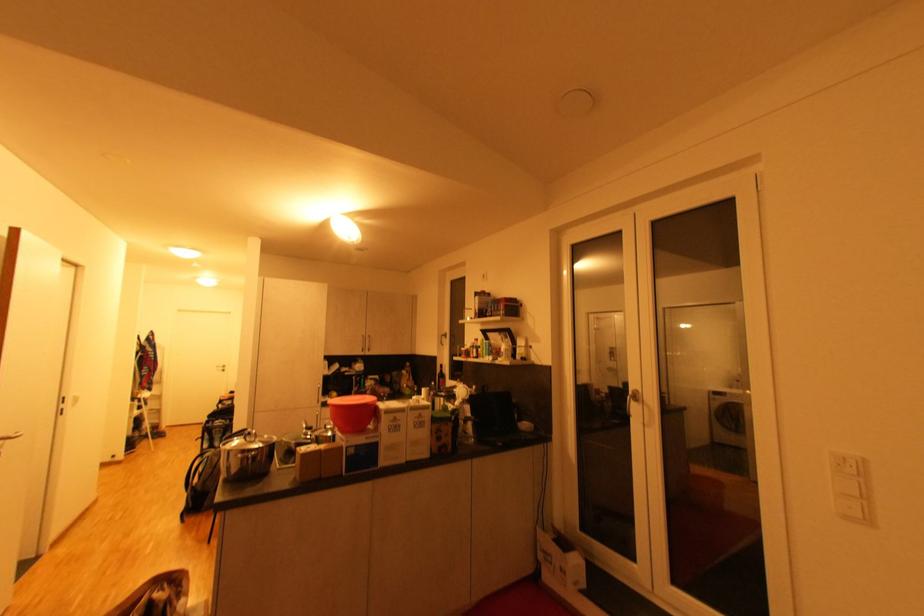
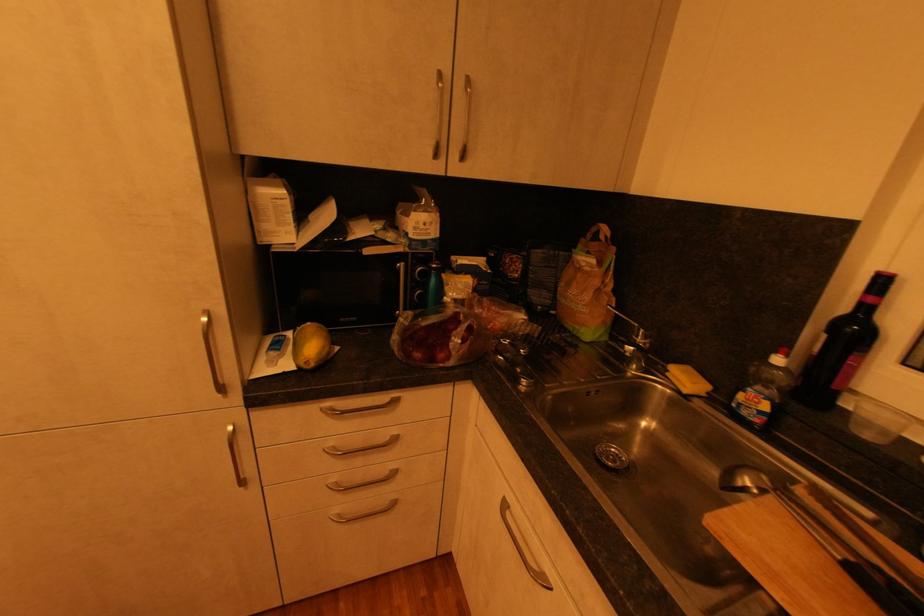
In the second image, find the point that corresponds to point 368,352 in the first image.

(441, 156)